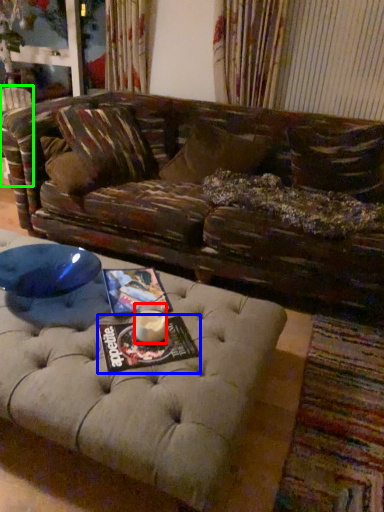
Question: Considering the real-world distances, which object is closest to beverage (highlighted by a red box)? magazine (highlighted by a blue box) or swivel chair (highlighted by a green box).

Choices:
 (A) magazine
 (B) swivel chair

Answer: (A)